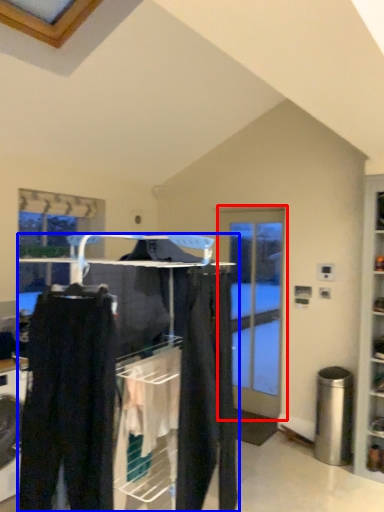
Question: Which object is further to the camera taking this photo, door (highlighted by a red box) or closet (highlighted by a blue box)?

Choices:
 (A) door
 (B) closet

Answer: (A)